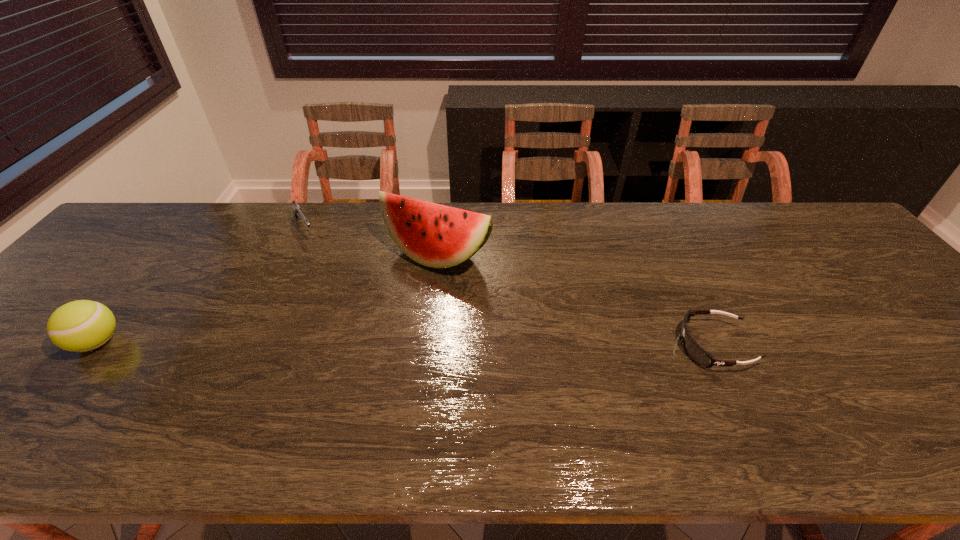
Identify the location of vacant spot on the desktop that is between the third shortest object and the goggles and is positioned on the outer rind of the tallest object. (370, 344).

I want to click on free space on the desktop that is between the tennis ball and the goggles and is positioned on the front-facing side of the pistol, so click(380, 344).